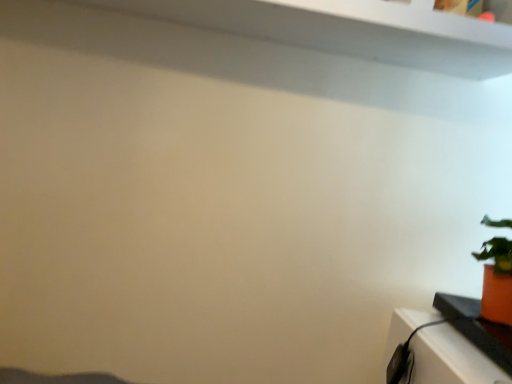
This screenshot has height=384, width=512. Describe the element at coordinates (451, 358) in the screenshot. I see `orange matte pot at right` at that location.

This screenshot has width=512, height=384. I want to click on orange matte pot at right, so click(x=451, y=358).

Image resolution: width=512 pixels, height=384 pixels. What do you see at coordinates (497, 280) in the screenshot?
I see `orange matte pot at right` at bounding box center [497, 280].

Identify the location of orange matte pot at right. This screenshot has height=384, width=512. (497, 280).

Find the location of a particular element. The image size is (512, 384). orange matte pot at right is located at coordinates (451, 358).

Can you confirm if orange matte pot at right is positioned to the left of orange matte pot at right?

No, orange matte pot at right is not to the left of orange matte pot at right.

Is the position of orange matte pot at right more distant than that of orange matte pot at right?

Yes.

Which point is more forward, (490, 300) or (457, 382)?

Point (457, 382)

From the image's perspective, is orange matte pot at right located beneath orange matte pot at right?

No, from the image's perspective, orange matte pot at right is not below orange matte pot at right.

From a real-world perspective, is orange matte pot at right above or below orange matte pot at right?

Clearly, from a real-world perspective, orange matte pot at right is above orange matte pot at right.

Which object is thinner, orange matte pot at right or orange matte pot at right?

With smaller width is orange matte pot at right.

In the scene shown: Considering the sizes of objects orange matte pot at right and orange matte pot at right in the image provided, who is taller, orange matte pot at right or orange matte pot at right?

orange matte pot at right is taller.

Between orange matte pot at right and orange matte pot at right, which one has larger size?

orange matte pot at right is bigger.

Is orange matte pot at right situated inside orange matte pot at right or outside?

orange matte pot at right is outside orange matte pot at right.

Is orange matte pot at right with orange matte pot at right?

No, orange matte pot at right is not in contact with orange matte pot at right.

Is orange matte pot at right facing towards orange matte pot at right?

No, orange matte pot at right is not turned towards orange matte pot at right.

The image size is (512, 384). Identify the location of table on the left of orange matte pot at right. (451, 358).

Considering the positions of objects orange matte pot at right and orange matte pot at right in the image provided, who is more to the left, orange matte pot at right or orange matte pot at right?

Positioned to the left is orange matte pot at right.

Is orange matte pot at right closer to camera compared to orange matte pot at right?

Yes, it is.

Which is closer to the camera, (444, 381) or (495, 279)?

The point (444, 381) is closer to the camera.

From the image's perspective, does orange matte pot at right appear lower than orange matte pot at right?

Indeed, from the image's perspective, orange matte pot at right is shown beneath orange matte pot at right.

From a real-world perspective, is orange matte pot at right on top of orange matte pot at right?

No, from a real-world perspective, orange matte pot at right is not above orange matte pot at right.

Is orange matte pot at right thinner than orange matte pot at right?

No, orange matte pot at right is not thinner than orange matte pot at right.

In terms of height, does orange matte pot at right look taller or shorter compared to orange matte pot at right?

Considering their sizes, orange matte pot at right has less height than orange matte pot at right.

Looking at the image, does orange matte pot at right seem bigger or smaller compared to orange matte pot at right?

In the image, orange matte pot at right appears to be smaller than orange matte pot at right.

Is orange matte pot at right positioned beyond the bounds of orange matte pot at right?

Yes, orange matte pot at right is not within orange matte pot at right.

Is orange matte pot at right placed right next to orange matte pot at right?

orange matte pot at right is not next to orange matte pot at right, and they're not touching.

Is orange matte pot at right at the back of orange matte pot at right?

No, orange matte pot at right is not facing the opposite direction of orange matte pot at right.

This screenshot has height=384, width=512. I want to click on houseplant behind the orange matte pot at right, so click(497, 280).

Where is `table below the orange matte pot at right (from the image's perspective)`? table below the orange matte pot at right (from the image's perspective) is located at coordinates (451, 358).

Where is `houseplant behind the orange matte pot at right`? houseplant behind the orange matte pot at right is located at coordinates (497, 280).